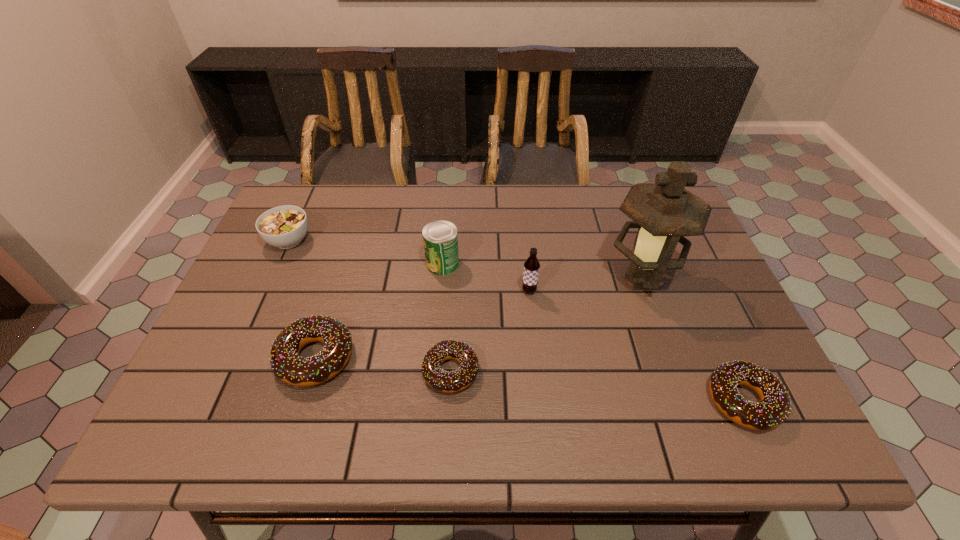
At what (x,y) coordinates should I click in order to perform the action: click on the second tallest object. Please return your answer as a coordinate pair (x, y). This screenshot has width=960, height=540. Looking at the image, I should click on (531, 266).

Where is `blank area located 0.150m on the left of the second object from left to right`? blank area located 0.150m on the left of the second object from left to right is located at coordinates (211, 357).

You are a GUI agent. You are given a task and a screenshot of the screen. Output one action in this format:
    pyautogui.click(x=<x>, y=<y>)
    Task: Click on the blank space located 0.310m on the left of the shortest doughnut
    
    Given the screenshot: What is the action you would take?
    pyautogui.click(x=282, y=371)

This screenshot has height=540, width=960. Identify the location of vacant area situated on the back of the second shortest doughnut. (678, 255).

The height and width of the screenshot is (540, 960). In order to click on vacant space located 0.090m on the right of the tallest object in this screenshot , I will do `click(715, 277)`.

At what (x,y) coordinates should I click in order to perform the action: click on vacant position located on the right of the fourth shortest object. Please return your answer as a coordinate pair (x, y). Image resolution: width=960 pixels, height=540 pixels. Looking at the image, I should click on (409, 240).

The image size is (960, 540). I want to click on free space located on the front of the fifth shortest object, so click(440, 295).

Find the location of a particular element. vacant area located 0.080m on the front of the second tallest object is located at coordinates (532, 322).

You are a GUI agent. You are given a task and a screenshot of the screen. Output one action in this format:
    pyautogui.click(x=<x>, y=<y>)
    Task: Click on the object that is at the far edge
    This screenshot has height=540, width=960.
    Given the screenshot: What is the action you would take?
    pyautogui.click(x=285, y=226)

Where is `object at the left edge`? The image size is (960, 540). object at the left edge is located at coordinates (285, 226).